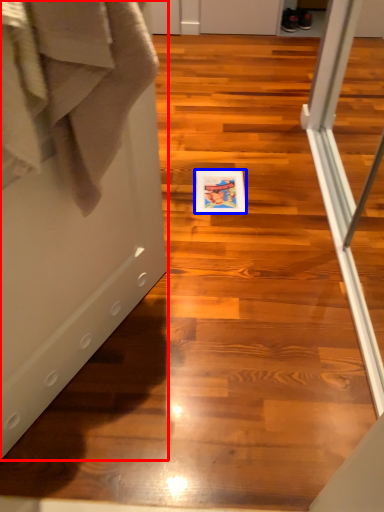
Question: Which object appears farthest to the camera in this image, screen door (highlighted by a red box) or postcard (highlighted by a blue box)?

Choices:
 (A) screen door
 (B) postcard

Answer: (B)